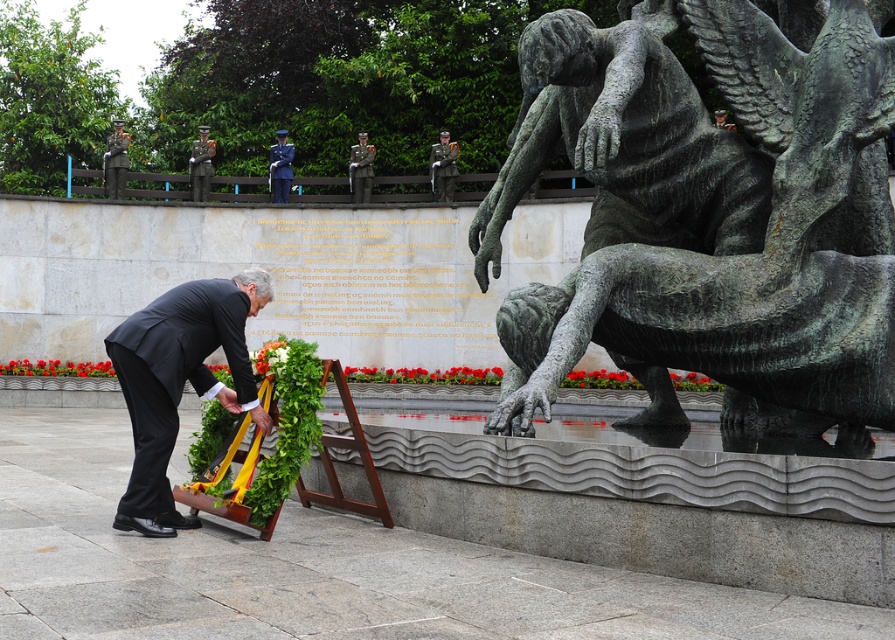
You are standing in the memorial area and see the green leafy wreath at lower left and the shiny silver uniform at center. Which object is positioned more to the left side of the scene?

The green leafy wreath at lower left is positioned more to the left side of the scene compared to the shiny silver uniform at center.

You are a photographer standing at the center of the memorial scene. You want to take a photo that includes both the floral wreath and the inscriptions on the stone wall. The wreath is located at point (198, 129) and the inscriptions are at point (286, 179). Based on their positions, which object should you focus on first to ensure both are in sharp focus?

Point (198, 129) is further to the camera than point (286, 179). To ensure both are in sharp focus, you should focus on the point closer to the camera first, which is point (286, 179).

You are observing a memorial ceremony and notice two people in shiny black uniform at center and shiny silver uniform at center. Which one is positioned to the left?

The shiny black uniform at center is positioned to the left of the shiny silver uniform at center.